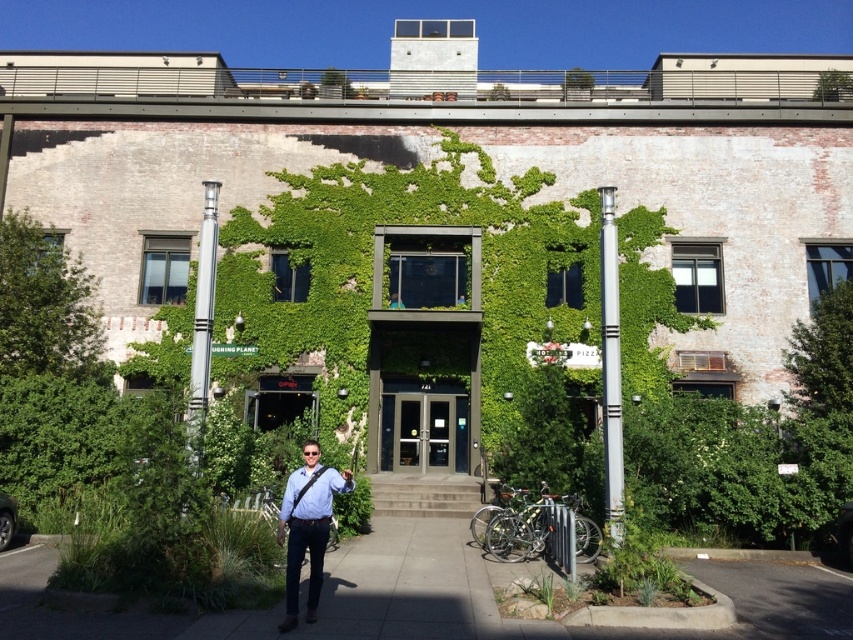
Between gray concrete sidewalk at center and silver metallic pole at center-right, which one appears on the left side from the viewer's perspective?

gray concrete sidewalk at center

Between gray concrete sidewalk at center and silver metallic pole at center-right, which one appears on the right side from the viewer's perspective?

Positioned to the right is silver metallic pole at center-right.

Between point (453, 557) and point (596, 189), which one is positioned behind?

The point (596, 189) is behind.

The height and width of the screenshot is (640, 853). Find the location of `gray concrete sidewalk at center`. gray concrete sidewalk at center is located at coordinates (537, 572).

Is gray concrete sidewalk at center taller than matte blue shirt at center?

Incorrect, gray concrete sidewalk at center's height is not larger of matte blue shirt at center's.

Can you confirm if gray concrete sidewalk at center is smaller than matte blue shirt at center?

Incorrect, gray concrete sidewalk at center is not smaller in size than matte blue shirt at center.

Is point (457, 621) positioned before point (300, 477)?

No.

Identify the location of gray concrete sidewalk at center. Image resolution: width=853 pixels, height=640 pixels. (537, 572).

Which is more to the left, matte glass doors at center or silver metallic pole at center-right?

From the viewer's perspective, matte glass doors at center appears more on the left side.

Can you confirm if matte glass doors at center is positioned to the left of silver metallic pole at center-right?

Correct, you'll find matte glass doors at center to the left of silver metallic pole at center-right.

Identify the location of matte glass doors at center. The height and width of the screenshot is (640, 853). (422, 432).